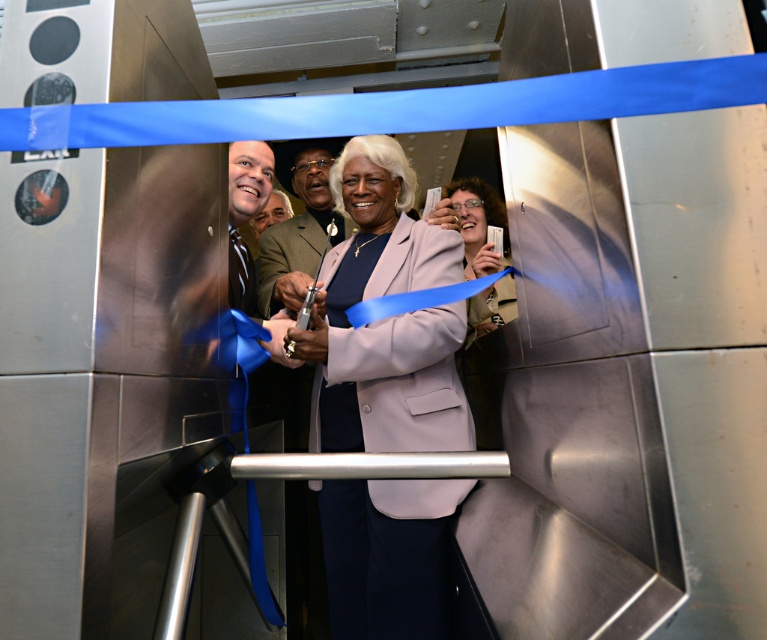
Question: Estimate the real-world distances between objects in this image. Which object is closer to the matte purple jacket at center?

Choices:
 (A) light brown leather jacket at center
 (B) matte pink blazer at center

Answer: (B)

Question: Does matte pink blazer at center have a larger size compared to matte purple jacket at center?

Choices:
 (A) no
 (B) yes

Answer: (A)

Question: Can you confirm if matte pink blazer at center is positioned to the left of matte purple jacket at center?

Choices:
 (A) yes
 (B) no

Answer: (A)

Question: Which object is positioned farthest from the matte purple jacket at center?

Choices:
 (A) matte pink blazer at center
 (B) light brown leather jacket at center

Answer: (B)

Question: Can you confirm if light brown leather jacket at center is thinner than matte purple jacket at center?

Choices:
 (A) yes
 (B) no

Answer: (A)

Question: Which object appears closest to the camera in this image?

Choices:
 (A) matte pink blazer at center
 (B) light brown leather jacket at center
 (C) matte purple jacket at center

Answer: (A)